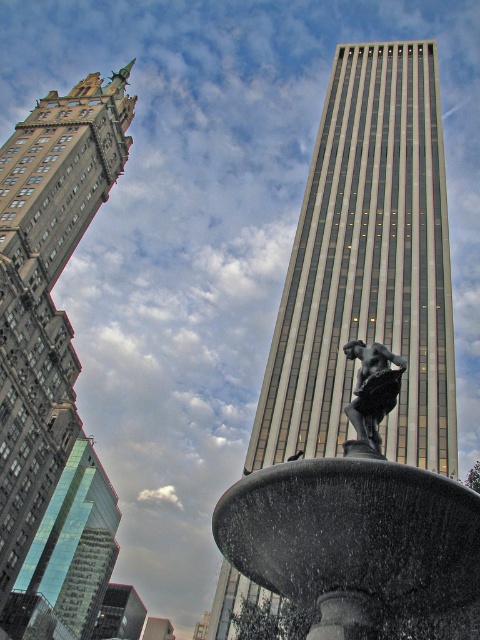
You are a photographer planning to take a photo of the green glass skyscraper at lower left and the bronze statue at center. Which object should you focus on first if you want to capture both in a single frame without moving the camera?

You should focus on the green glass skyscraper at lower left first because it is bigger than the bronze statue at center, so it will require more attention in the frame.

You are a city planner trying to install a new 90 meter long walkway between the polished bronze statue at center and the green glass skyscraper at lower left. Based on the scene, will the walkway fit between them?

The distance between the polished bronze statue at center and the green glass skyscraper at lower left is 89.40 meters. Since the walkway is 90 meters long, it will be 0.60 meters too long to fit between them.

You are standing at the fountain and want to take a photo of the polished bronze statue at center. Which direction should you face to ensure the statue is in the center of your photo?

You should face the direction where the polished bronze statue at center is located, which is at point coordinates of (x=360, y=529). Since the statue is at the center of the fountain, facing towards it would center it in your photo.